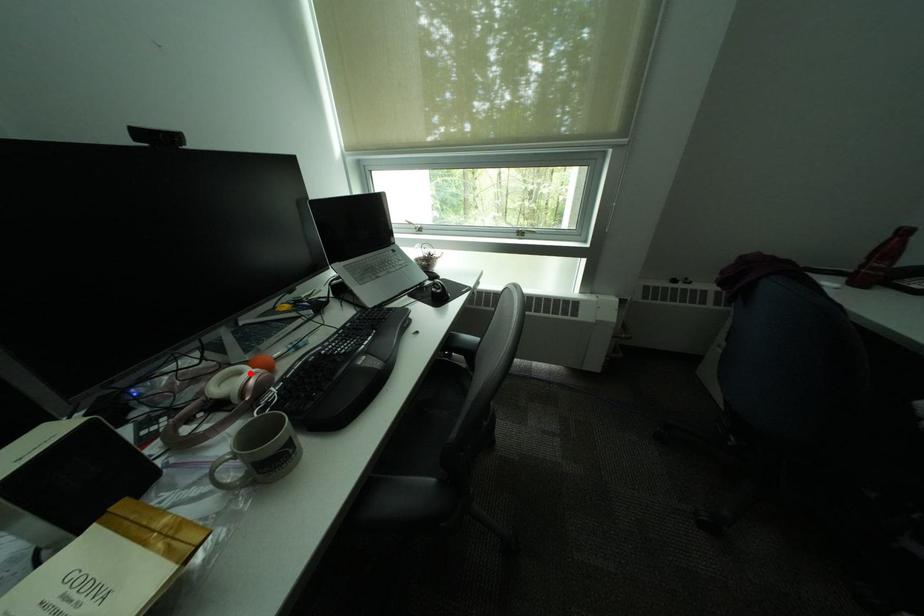
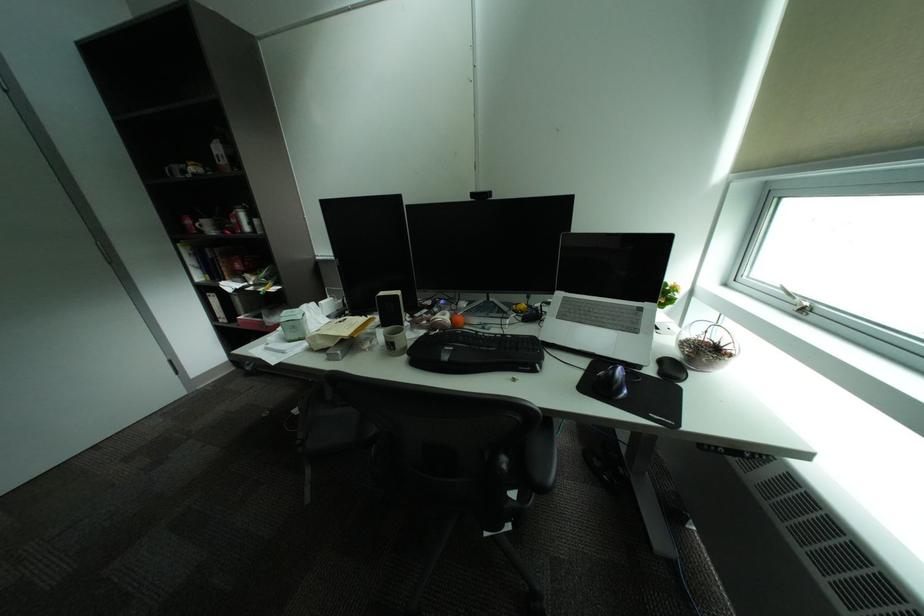
Find the pixel in the second image that matches the highlighted location in the first image.

(456, 315)